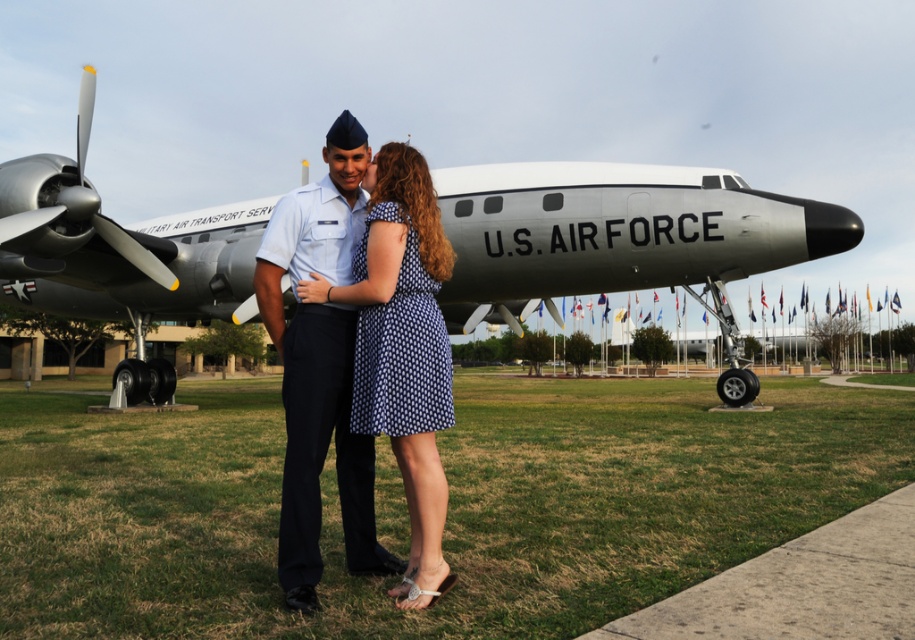
You are a photographer trying to capture a clear shot of the two points mentioned in the scene. Which point, point [272,241] or point [120,244], is positioned closer to you?

Point [272,241] is closer to the viewer than point [120,244].

You are a photographer trying to capture a clear photo of the silver metallic airplane at center and the silver metallic propeller at upper left. Since both are silver, you want to ensure the propeller is visible. Based on their sizes, which object will be easier to spot in the photo?

The silver metallic airplane at center is larger in size than the silver metallic propeller at upper left, so the airplane will be easier to spot in the photo.